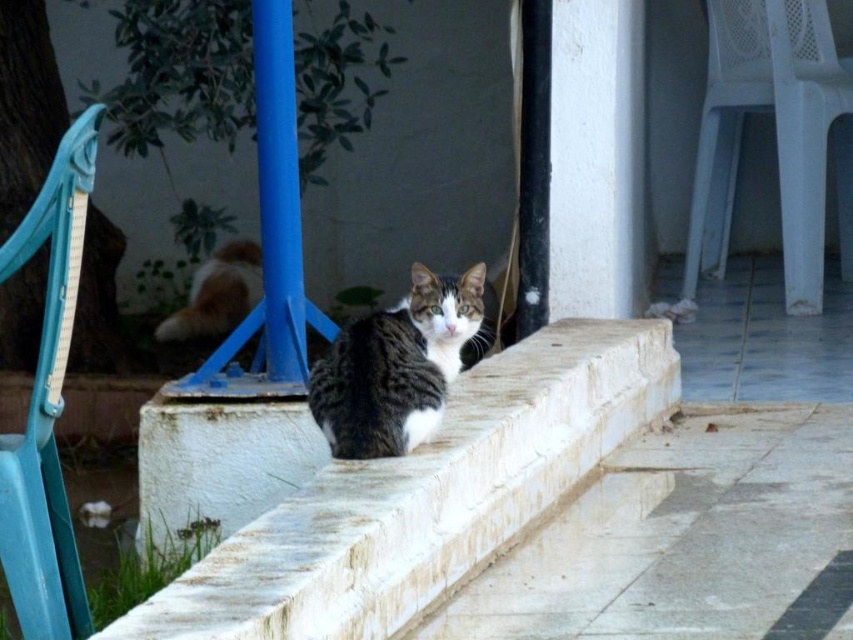
Can you confirm if white stone ledge at center is positioned above gray tabby cat at center?

Incorrect, white stone ledge at center is not positioned above gray tabby cat at center.

You are a GUI agent. You are given a task and a screenshot of the screen. Output one action in this format:
    pyautogui.click(x=<x>, y=<y>)
    Task: Click on the white stone ledge at center
    
    Given the screenshot: What is the action you would take?
    pyautogui.click(x=426, y=496)

Locate an element on the screen. white stone ledge at center is located at coordinates (426, 496).

Who is lower down, white plastic chair at right or teal plastic chair at left?

Positioned lower is teal plastic chair at left.

Can you confirm if white plastic chair at right is taller than teal plastic chair at left?

Correct, white plastic chair at right is much taller as teal plastic chair at left.

In order to click on white plastic chair at right in this screenshot , I will do `click(775, 136)`.

What do you see at coordinates (683, 538) in the screenshot? I see `white stone steps at center` at bounding box center [683, 538].

Is white stone steps at center taller than teal plastic chair at left?

No.

Does point (720, 435) come behind point (38, 596)?

Yes, point (720, 435) is behind point (38, 596).

Identify the location of white stone steps at center. (683, 538).